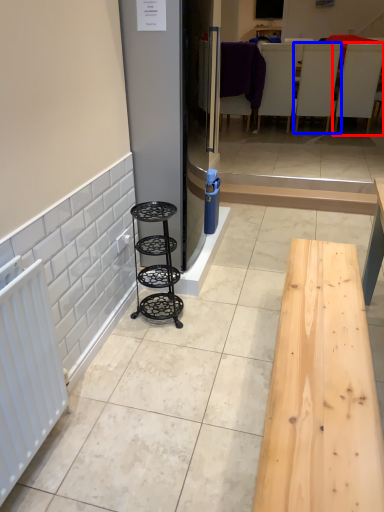
Question: Among these objects, which one is nearest to the camera, furniture (highlighted by a red box) or furniture (highlighted by a blue box)?

Choices:
 (A) furniture
 (B) furniture

Answer: (A)